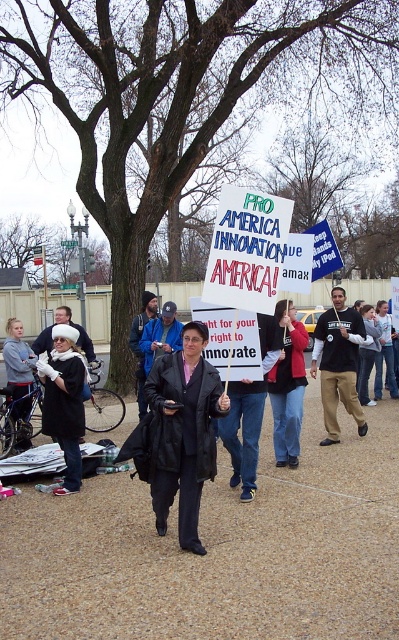
Which is more to the left, matte black jacket at center or dark gray hoodie at center?

Positioned to the left is dark gray hoodie at center.

Between point (290, 300) and point (35, 356), which one is positioned in front?

Point (290, 300) is in front.

Does point (294, 432) lie in front of point (5, 364)?

Yes.

The height and width of the screenshot is (640, 399). In order to click on matte black jacket at center in this screenshot , I will do `click(288, 387)`.

Is point (327, 328) more distant than point (270, 378)?

Yes, it is.

Does dark gray cotton hoodie at center have a lesser width compared to matte black jacket at center?

Incorrect, dark gray cotton hoodie at center's width is not less than matte black jacket at center's.

Is point (331, 381) positioned before point (282, 436)?

No, (331, 381) is behind (282, 436).

The width and height of the screenshot is (399, 640). Find the location of `dark gray cotton hoodie at center`. dark gray cotton hoodie at center is located at coordinates (337, 364).

Who is higher up, white fur hat at left or matte black jacket at center?

matte black jacket at center

Is white fur hat at left below matte black jacket at center?

Yes, white fur hat at left is below matte black jacket at center.

Describe the element at coordinates (65, 401) in the screenshot. This screenshot has height=640, width=399. I see `white fur hat at left` at that location.

Locate an element on the screen. The width and height of the screenshot is (399, 640). white fur hat at left is located at coordinates (65, 401).